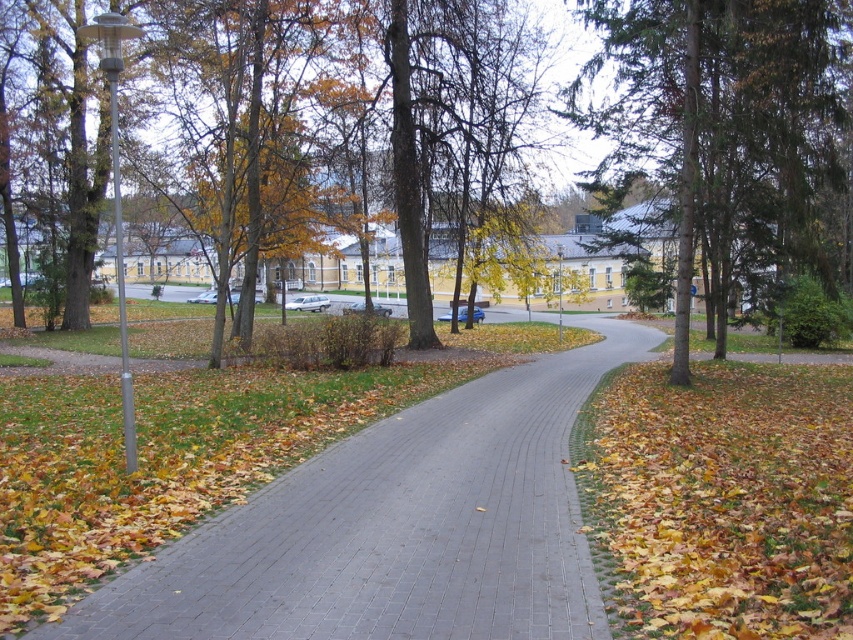
Based on the photo, is yellow dry leaves at lower right above green evergreen tree at upper right?

Incorrect, yellow dry leaves at lower right is not positioned above green evergreen tree at upper right.

Between yellow dry leaves at lower right and green evergreen tree at upper right, which one appears on the left side from the viewer's perspective?

yellow dry leaves at lower right is more to the left.

Locate an element on the screen. This screenshot has width=853, height=640. yellow dry leaves at lower right is located at coordinates (721, 499).

Which of these two, gray brick pavement at center or yellow dry leaves at lower right, stands taller?

gray brick pavement at center is taller.

Which is behind, point (264, 596) or point (666, 515)?

The point (666, 515) is behind.

Who is more forward, (x=352, y=442) or (x=674, y=433)?

Positioned in front is point (x=352, y=442).

This screenshot has height=640, width=853. I want to click on gray brick pavement at center, so (x=397, y=528).

Based on the photo, between gray brick pavement at center and green evergreen tree at upper right, which one appears on the right side from the viewer's perspective?

green evergreen tree at upper right is more to the right.

Does gray brick pavement at center have a greater height compared to green evergreen tree at upper right?

In fact, gray brick pavement at center may be shorter than green evergreen tree at upper right.

Locate an element on the screen. Image resolution: width=853 pixels, height=640 pixels. gray brick pavement at center is located at coordinates (397, 528).